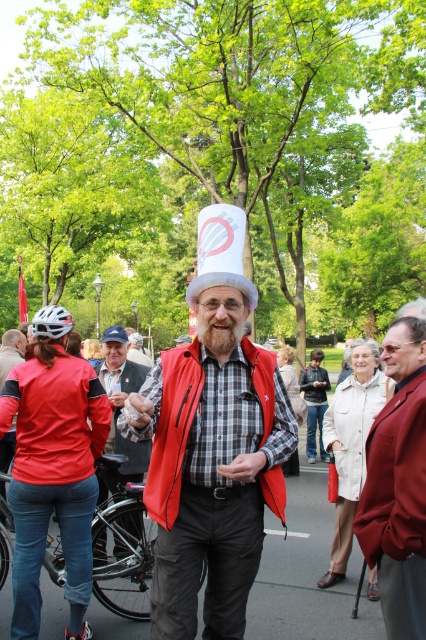
You are a photographer trying to capture the man in the scene. You want to ensure both the white cotton coat at center and the white paper hat at center are clearly visible in your photo. Since they are both white, will the hat be visible behind the coat?

The white cotton coat at center is in front of the white paper hat at center, so the hat may not be fully visible behind the coat due to their similar color and the coat being in front.

You are a photographer setting up a camera to capture the scene. You need to position yourself so that both the matte red jacket at left and the matte black vest at center are in frame. Given that your camera has a maximum focal length that allows capturing objects within a 20 inch distance, will you be able to include both objects in the same shot?

The distance between the matte red jacket at left and the matte black vest at center is 20.29 inches. Since your camera can only capture objects within a 20 inch distance, you will not be able to include both objects in the same shot as the distance exceeds the camera limit.

You are a tailor measuring the distance between two garments for a custom fitting. The garments are the matte black vest at center and the white cotton coat at center. The minimum space required for your equipment is 1.5 meters. Can you fit your equipment between them?

The matte black vest at center and white cotton coat at center are 1.69 meters apart from each other, which is more than the required 1.5 meters. Therefore, the equipment can fit between them.